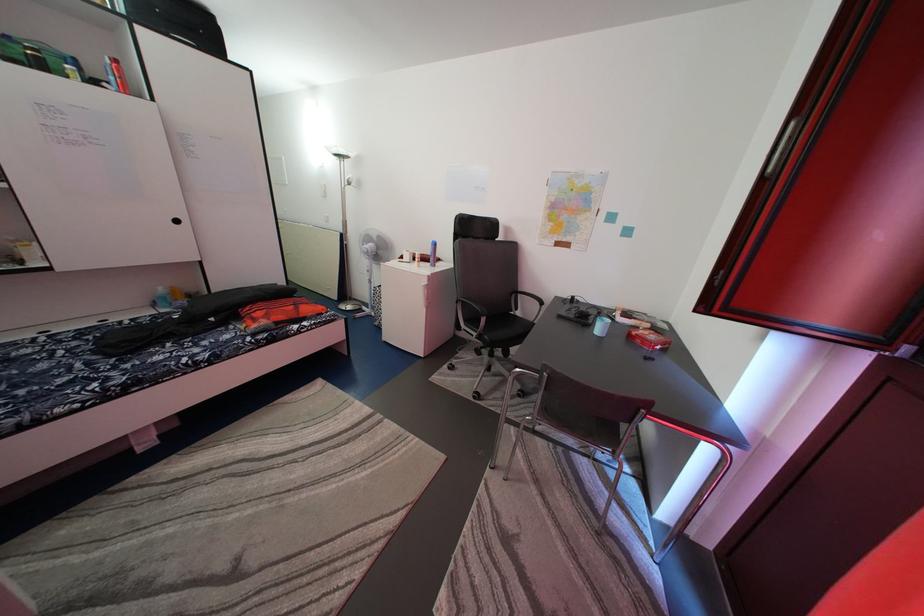
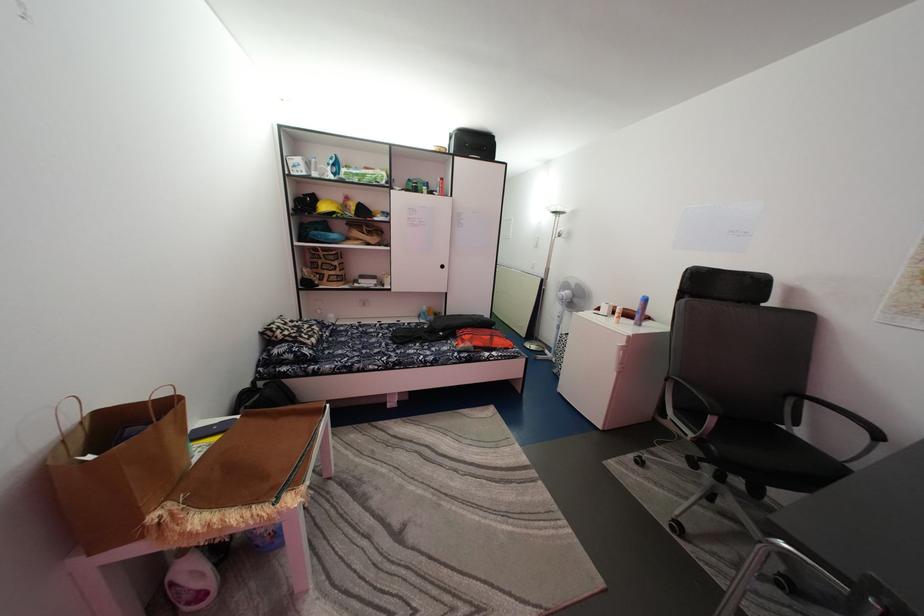
Locate, in the second image, the point that corresponds to the point at 433,265 in the first image.

(637, 322)